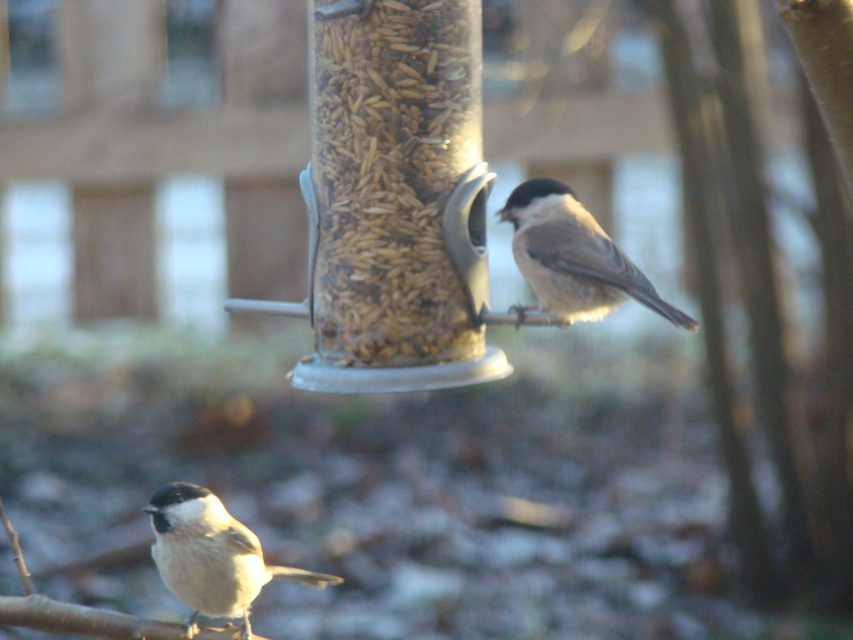
Consider the image. Is soft gray feathers at upper right below soft gray feathers at lower left?

No, soft gray feathers at upper right is not below soft gray feathers at lower left.

Is point (518, 188) farther from camera compared to point (212, 547)?

Yes.

This screenshot has width=853, height=640. What do you see at coordinates (573, 257) in the screenshot?
I see `soft gray feathers at upper right` at bounding box center [573, 257].

Locate an element on the screen. soft gray feathers at upper right is located at coordinates (573, 257).

Is brown grain at center thinner than soft gray feathers at lower left?

Yes, brown grain at center is thinner than soft gray feathers at lower left.

Is brown grain at center below soft gray feathers at lower left?

Actually, brown grain at center is above soft gray feathers at lower left.

I want to click on brown grain at center, so click(390, 177).

Between brown grain at center and soft gray feathers at upper right, which one is positioned lower?

Positioned lower is soft gray feathers at upper right.

Can you confirm if brown grain at center is thinner than soft gray feathers at upper right?

Yes.

This screenshot has width=853, height=640. What do you see at coordinates (390, 177) in the screenshot?
I see `brown grain at center` at bounding box center [390, 177].

Find the location of a particular element. brown grain at center is located at coordinates (390, 177).